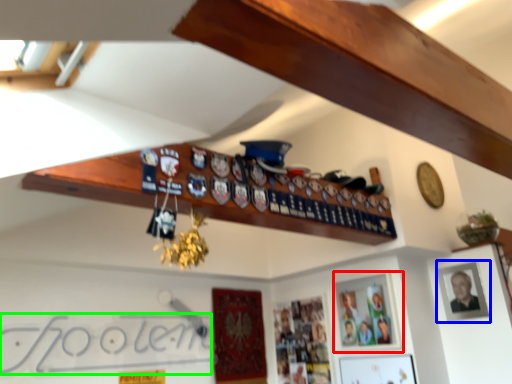
Question: Based on their relative distances, which object is nearer to picture frame (highlighted by a red box)? Choose from picture frame (highlighted by a blue box) and signature (highlighted by a green box).

Choices:
 (A) picture frame
 (B) signature

Answer: (A)